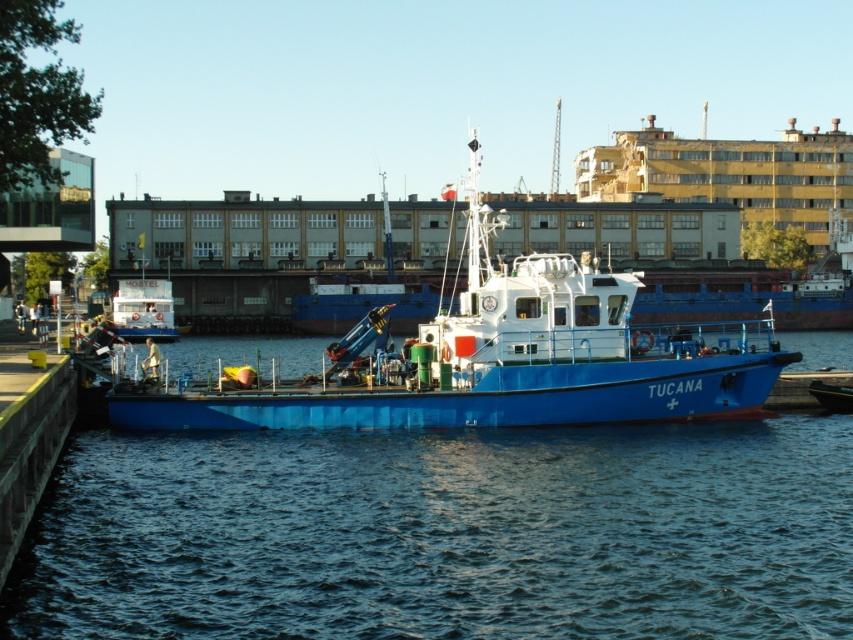
Question: Which point is farther to the camera?

Choices:
 (A) (334, 541)
 (B) (480, 296)

Answer: (B)

Question: Does blue rubber boat at center have a larger size compared to white glossy boat at center?

Choices:
 (A) no
 (B) yes

Answer: (B)

Question: Which is farther from the white glossy boat at center?

Choices:
 (A) blue rubber boat at center
 (B) blue matte boat at center

Answer: (A)

Question: Does blue rubber boat at center appear on the right side of white glossy boat at center?

Choices:
 (A) yes
 (B) no

Answer: (A)

Question: Does blue rubber boat at center appear on the right side of white glossy boat at center?

Choices:
 (A) yes
 (B) no

Answer: (A)

Question: Which of the following is the farthest from the observer?

Choices:
 (A) (479, 385)
 (B) (138, 545)

Answer: (A)